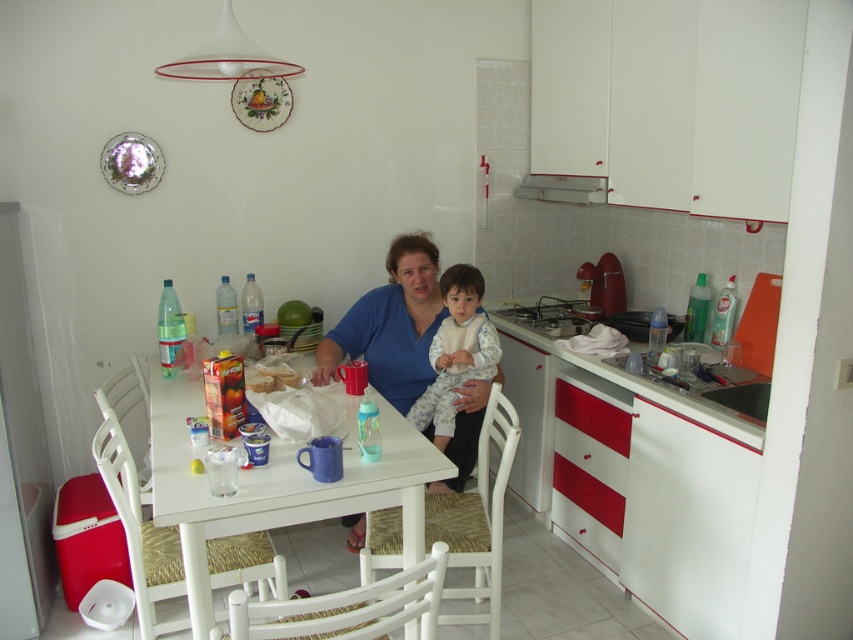
Question: Does white glossy table at center lie in front of blue fabric shirt at center?

Choices:
 (A) no
 (B) yes

Answer: (B)

Question: In this image, where is white glossy table at center located relative to fluffy white pajamas at center?

Choices:
 (A) above
 (B) below

Answer: (B)

Question: Is white glossy table at center bigger than fluffy white pajamas at center?

Choices:
 (A) yes
 (B) no

Answer: (A)

Question: Based on their relative distances, which object is nearer to the blue fabric shirt at center?

Choices:
 (A) white glossy table at center
 (B) fluffy white pajamas at center

Answer: (B)

Question: Estimate the real-world distances between objects in this image. Which object is closer to the fluffy white pajamas at center?

Choices:
 (A) white glossy table at center
 (B) blue fabric shirt at center

Answer: (B)

Question: Which point is farther to the camera?

Choices:
 (A) (457, 262)
 (B) (386, 323)
 (C) (225, 531)

Answer: (A)